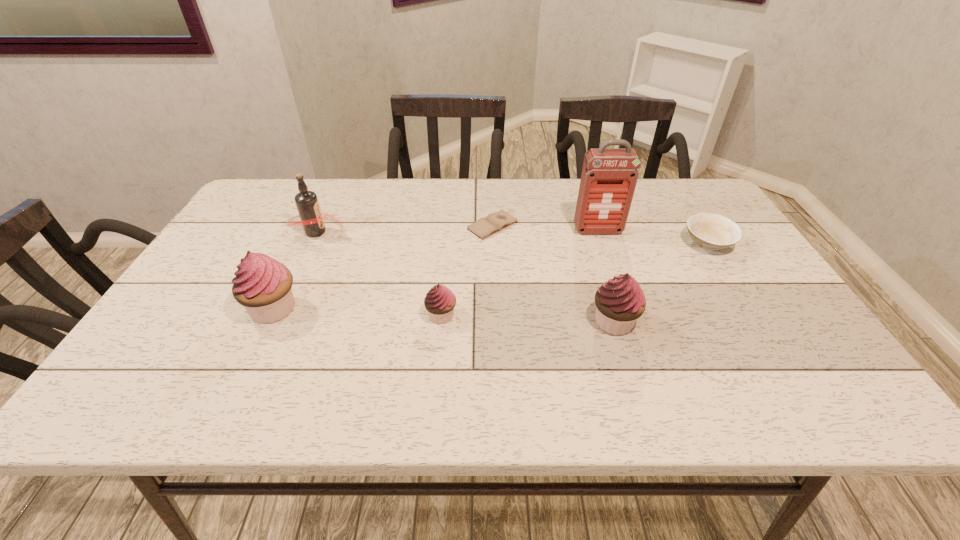
With all cupcakes evenly spaced, where should an extra cupcake be placed on the right to continue the pattern? Please point out a vacant space. Please provide its 2D coordinates. Your answer should be formatted as a tuple, i.e. [(x, y)], where the tuple contains the x and y coordinates of a point satisfying the conditions above.

[(792, 328)]